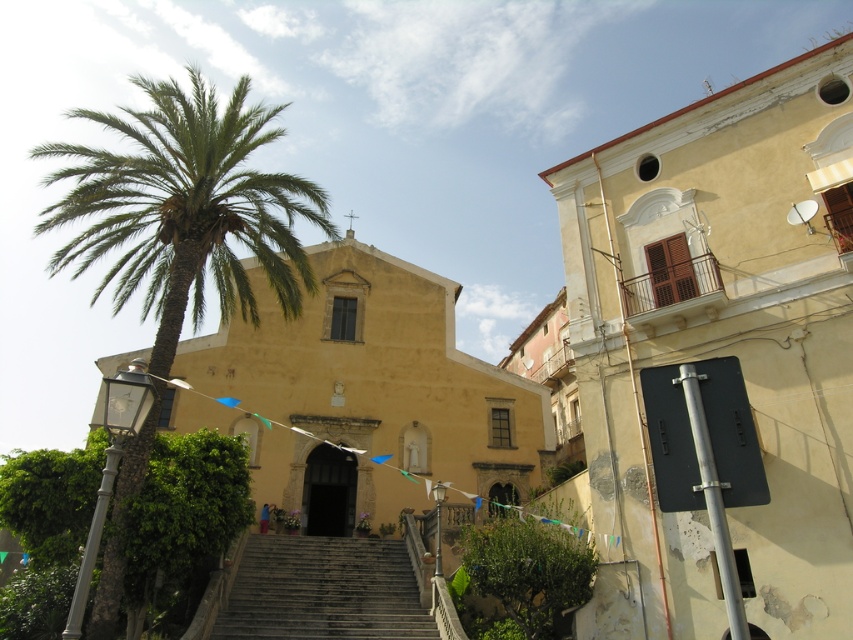
Does green leafy palm at left have a greater width compared to dark gray stone stairs at center?

Correct, the width of green leafy palm at left exceeds that of dark gray stone stairs at center.

Can you confirm if green leafy palm at left is positioned to the right of dark gray stone stairs at center?

In fact, green leafy palm at left is to the left of dark gray stone stairs at center.

Is point (74, 250) closer to viewer compared to point (380, 548)?

That is True.

Identify the location of green leafy palm at left. (184, 208).

Can you confirm if yellow matte building at upper right is wider than green leafy palm at left?

No, yellow matte building at upper right is not wider than green leafy palm at left.

What do you see at coordinates (720, 342) in the screenshot? The image size is (853, 640). I see `yellow matte building at upper right` at bounding box center [720, 342].

The width and height of the screenshot is (853, 640). What are the coordinates of `yellow matte building at upper right` in the screenshot? It's located at (720, 342).

Does yellow matte building at upper right have a lesser height compared to dark gray stone stairs at center?

In fact, yellow matte building at upper right may be taller than dark gray stone stairs at center.

Is point (590, 150) positioned in front of point (368, 612)?

No, it is not.

Based on the photo, measure the distance between yellow matte building at upper right and camera.

yellow matte building at upper right and camera are 8.43 meters apart from each other.

The image size is (853, 640). I want to click on yellow matte building at upper right, so click(720, 342).